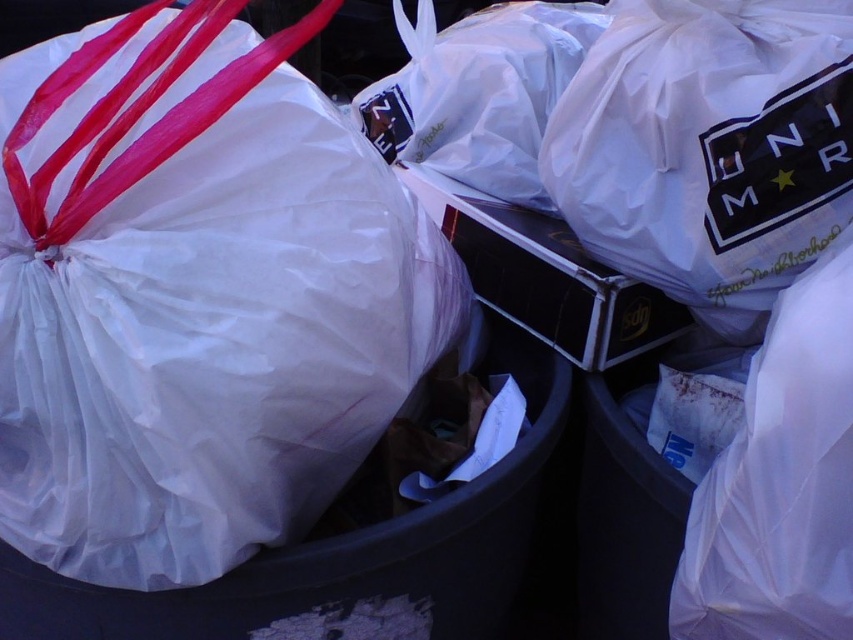
You are standing next to the trash bin and need to retrieve the white plastic bag at left. Can you estimate its position relative to the other objects in the bin based on its coordinates?

The white plastic bag at left is located at coordinates point (195, 296). However, without additional information about the positions of other objects in the bin, it is not possible to determine its exact spatial relationship to them.

Consider the image. You need to choose a bag to place a heavy item into. Based on the scene, which white plastic bag between the white plastic bag at left and the white plastic bag at upper right would be more suitable?

The white plastic bag at left has a larger size compared to the white plastic bag at upper right, so it would be more suitable for holding a heavy item as it likely has more capacity and sturdiness.